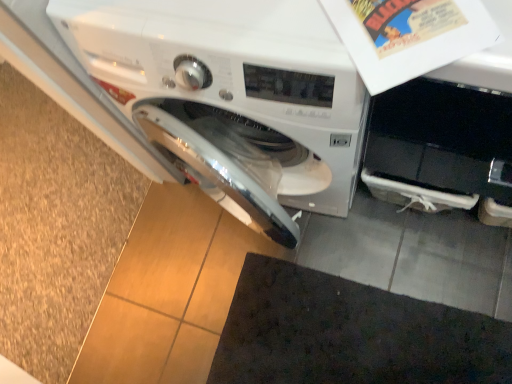
Question: From a real-world perspective, is dark fabric doormat at lower center below white glossy washing machine at center?

Choices:
 (A) no
 (B) yes

Answer: (B)

Question: Can you confirm if dark fabric doormat at lower center is positioned to the right of white glossy washing machine at center?

Choices:
 (A) yes
 (B) no

Answer: (A)

Question: Considering the relative sizes of dark fabric doormat at lower center and white glossy washing machine at center in the image provided, is dark fabric doormat at lower center smaller than white glossy washing machine at center?

Choices:
 (A) no
 (B) yes

Answer: (B)

Question: Is dark fabric doormat at lower center outside of white glossy washing machine at center?

Choices:
 (A) yes
 (B) no

Answer: (A)

Question: Is dark fabric doormat at lower center oriented towards white glossy washing machine at center?

Choices:
 (A) no
 (B) yes

Answer: (A)

Question: From the image's perspective, is dark fabric doormat at lower center under white glossy washing machine at center?

Choices:
 (A) no
 (B) yes

Answer: (B)

Question: Is white glossy washing machine at center far away from dark fabric doormat at lower center?

Choices:
 (A) no
 (B) yes

Answer: (A)

Question: Can dark fabric doormat at lower center be found inside white glossy washing machine at center?

Choices:
 (A) yes
 (B) no

Answer: (B)

Question: From the image's perspective, is white glossy washing machine at center above dark fabric doormat at lower center?

Choices:
 (A) no
 (B) yes

Answer: (B)

Question: Is white glossy washing machine at center not inside dark fabric doormat at lower center?

Choices:
 (A) yes
 (B) no

Answer: (A)

Question: Does white glossy washing machine at center have a greater height compared to dark fabric doormat at lower center?

Choices:
 (A) yes
 (B) no

Answer: (A)

Question: From a real-world perspective, is white glossy washing machine at center under dark fabric doormat at lower center?

Choices:
 (A) no
 (B) yes

Answer: (A)

Question: From the image's perspective, relative to dark fabric doormat at lower center, is white glossy washing machine at center above or below?

Choices:
 (A) below
 (B) above

Answer: (B)